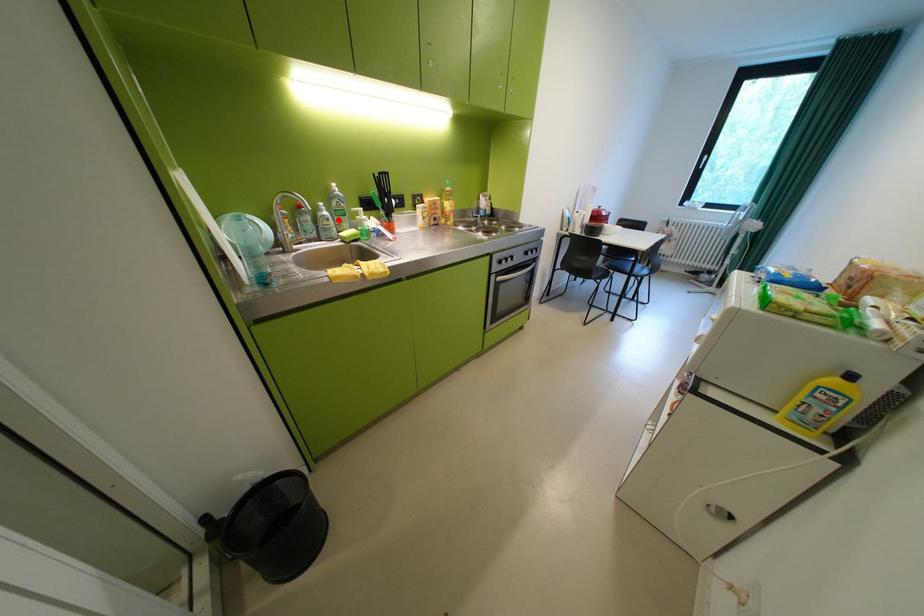
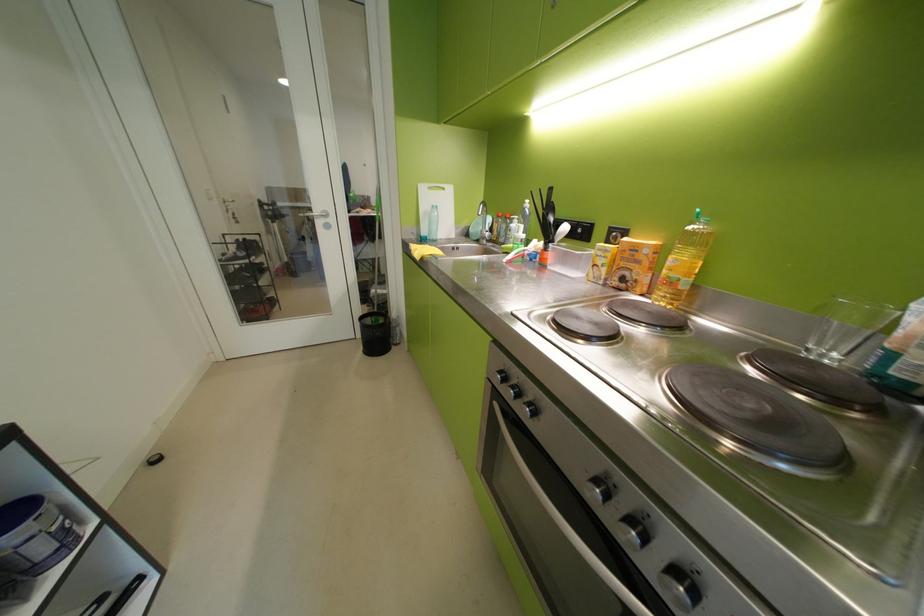
Question: I am providing you with two images of the same scene from different viewpoints. A red point is marked on the first image. Is the red point's position out of view in image 2?

Choices:
 (A) Yes
 (B) No

Answer: (A)